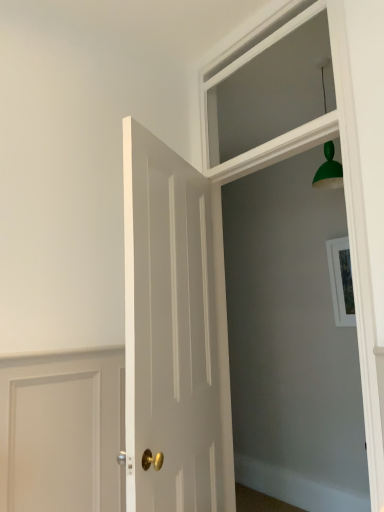
Question: Does clear glass window at upper center have a greater height compared to white wood frame at upper center?

Choices:
 (A) yes
 (B) no

Answer: (B)

Question: From a real-world perspective, is clear glass window at upper center on top of white wood frame at upper center?

Choices:
 (A) no
 (B) yes

Answer: (B)

Question: Is clear glass window at upper center looking in the opposite direction of white wood frame at upper center?

Choices:
 (A) no
 (B) yes

Answer: (A)

Question: Is clear glass window at upper center not close to white wood frame at upper center?

Choices:
 (A) yes
 (B) no

Answer: (B)

Question: Is clear glass window at upper center closer to the viewer compared to white wood frame at upper center?

Choices:
 (A) no
 (B) yes

Answer: (A)

Question: Does clear glass window at upper center lie behind white wood frame at upper center?

Choices:
 (A) no
 (B) yes

Answer: (B)

Question: Is clear glass window at upper center taller than white glossy door at center?

Choices:
 (A) no
 (B) yes

Answer: (A)

Question: Can you see clear glass window at upper center touching white glossy door at center?

Choices:
 (A) no
 (B) yes

Answer: (A)

Question: From a real-world perspective, does clear glass window at upper center stand above white glossy door at center?

Choices:
 (A) yes
 (B) no

Answer: (A)

Question: Would you say clear glass window at upper center is a long distance from white glossy door at center?

Choices:
 (A) no
 (B) yes

Answer: (A)

Question: Is clear glass window at upper center turned away from white glossy door at center?

Choices:
 (A) no
 (B) yes

Answer: (A)

Question: From the image's perspective, does clear glass window at upper center appear lower than white glossy door at center?

Choices:
 (A) no
 (B) yes

Answer: (A)

Question: Can you confirm if white wood frame at upper center is wider than clear glass window at upper center?

Choices:
 (A) yes
 (B) no

Answer: (A)